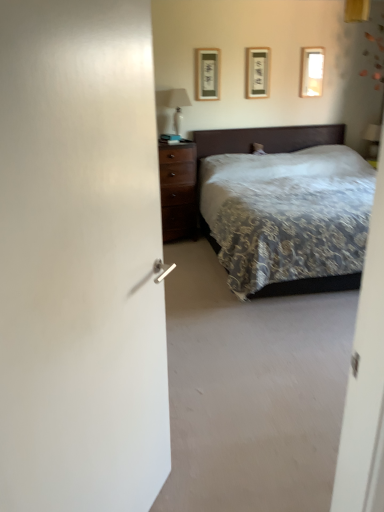
What is the approximate width of white glossy table lamp at upper center, placed as the second table lamp when sorted from right to left?

white glossy table lamp at upper center, placed as the second table lamp when sorted from right to left, is 10.51 inches wide.

Describe the element at coordinates (372, 139) in the screenshot. I see `matte white plastic table lamp at upper right, the 1th table lamp in the back-to-front sequence` at that location.

What do you see at coordinates (261, 143) in the screenshot?
I see `patterned fabric bed at center` at bounding box center [261, 143].

Measure the distance between matte black picture frame at upper center, which appears as the 3th picture frame when viewed from the right, and camera.

matte black picture frame at upper center, which appears as the 3th picture frame when viewed from the right, and camera are 16.75 feet apart from each other.

The image size is (384, 512). What are the coordinates of `matte glass picture frame at upper right, the 3th picture frame positioned from the left` in the screenshot? It's located at click(x=311, y=72).

Locate an element on the screen. Image resolution: width=384 pixels, height=512 pixels. white glossy table lamp at upper center, marked as the 1th table lamp in a left-to-right arrangement is located at coordinates (173, 104).

Is white glossy table lamp at upper center, placed as the second table lamp when sorted from right to left, facing away from patterned fabric bed at center?

No, white glossy table lamp at upper center, placed as the second table lamp when sorted from right to left,'s orientation is not away from patterned fabric bed at center.

Would you say white glossy table lamp at upper center, placed as the second table lamp when sorted from right to left, is to the left or to the right of patterned fabric bed at center in the picture?

white glossy table lamp at upper center, placed as the second table lamp when sorted from right to left, is to the left of patterned fabric bed at center.

From a real-world perspective, does white glossy table lamp at upper center, placed as the second table lamp when sorted from right to left, sit lower than patterned fabric bed at center?

No, from a real-world perspective, white glossy table lamp at upper center, placed as the second table lamp when sorted from right to left, is not under patterned fabric bed at center.

In order to click on bed to the right of white glossy table lamp at upper center, acting as the 1th table lamp starting from the front in this screenshot , I will do `click(261, 143)`.

Which is more to the left, matte wooden picture frame at upper center, which appears as the second picture frame when viewed from the left, or matte white plastic table lamp at upper right, acting as the 1th table lamp starting from the right?

matte wooden picture frame at upper center, which appears as the second picture frame when viewed from the left, is more to the left.

From the image's perspective, relative to matte white plastic table lamp at upper right, which is the 2th table lamp in front-to-back order, is matte wooden picture frame at upper center, which appears as the second picture frame when viewed from the left, above or below?

Based on their image positions, matte wooden picture frame at upper center, which appears as the second picture frame when viewed from the left, is located above matte white plastic table lamp at upper right, which is the 2th table lamp in front-to-back order.

Measure the distance from matte wooden picture frame at upper center, which appears as the second picture frame when viewed from the left, to matte white plastic table lamp at upper right, the 1th table lamp in the back-to-front sequence.

The distance of matte wooden picture frame at upper center, which appears as the second picture frame when viewed from the left, from matte white plastic table lamp at upper right, the 1th table lamp in the back-to-front sequence, is 1.85 meters.

Which of these two, matte wooden picture frame at upper center, which appears as the second picture frame when viewed from the left, or matte white plastic table lamp at upper right, which is the 2th table lamp in front-to-back order, is smaller?

Smaller between the two is matte wooden picture frame at upper center, which appears as the second picture frame when viewed from the left.

Is the position of patterned fabric bed at center more distant than that of matte black picture frame at upper center, which appears as the 3th picture frame when viewed from the right?

No.

Is matte black picture frame at upper center, arranged as the first picture frame when viewed from the left, a part of patterned fabric bed at center?

No, matte black picture frame at upper center, arranged as the first picture frame when viewed from the left, is not surrounded by patterned fabric bed at center.

Where is `the 1st picture frame behind the patterned fabric bed at center, counting from the anchor's position`? This screenshot has height=512, width=384. the 1st picture frame behind the patterned fabric bed at center, counting from the anchor's position is located at coordinates (207, 74).

Is there a large distance between patterned fabric bed at center and matte black picture frame at upper center, which appears as the 3th picture frame when viewed from the right?

patterned fabric bed at center is actually quite close to matte black picture frame at upper center, which appears as the 3th picture frame when viewed from the right.

Is white glossy table lamp at upper center, the 2th table lamp in the back-to-front sequence, far away from matte glass picture frame at upper right, the 1th picture frame when ordered from right to left?

Absolutely, white glossy table lamp at upper center, the 2th table lamp in the back-to-front sequence, is distant from matte glass picture frame at upper right, the 1th picture frame when ordered from right to left.

Visually, is white glossy table lamp at upper center, marked as the 1th table lamp in a left-to-right arrangement, positioned to the left or to the right of matte glass picture frame at upper right, the 3th picture frame positioned from the left?

Clearly, white glossy table lamp at upper center, marked as the 1th table lamp in a left-to-right arrangement, is on the left of matte glass picture frame at upper right, the 3th picture frame positioned from the left, in the image.

Considering the relative sizes of white glossy table lamp at upper center, acting as the 1th table lamp starting from the front, and matte glass picture frame at upper right, the 3th picture frame positioned from the left, in the image provided, is white glossy table lamp at upper center, acting as the 1th table lamp starting from the front, taller than matte glass picture frame at upper right, the 3th picture frame positioned from the left,?

Indeed, white glossy table lamp at upper center, acting as the 1th table lamp starting from the front, has a greater height compared to matte glass picture frame at upper right, the 3th picture frame positioned from the left.

From the image's perspective, which picture frame is the 3rd one above the white glossy table lamp at upper center, placed as the second table lamp when sorted from right to left? Please provide its 2D coordinates.

[(311, 72)]

From the image's perspective, which is below, matte black picture frame at upper center, arranged as the first picture frame when viewed from the left, or patterned fabric bed at center?

patterned fabric bed at center is shown below in the image.

Is matte black picture frame at upper center, arranged as the first picture frame when viewed from the left, smaller than patterned fabric bed at center?

Yes, matte black picture frame at upper center, arranged as the first picture frame when viewed from the left, is smaller than patterned fabric bed at center.

From a real-world perspective, count 3rd picture frames upward from the patterned fabric bed at center and point to it. Please provide its 2D coordinates.

[(207, 74)]

Is there a large distance between matte black picture frame at upper center, arranged as the first picture frame when viewed from the left, and matte white plastic table lamp at upper right, acting as the 1th table lamp starting from the right?

Yes, matte black picture frame at upper center, arranged as the first picture frame when viewed from the left, is far from matte white plastic table lamp at upper right, acting as the 1th table lamp starting from the right.

Would you say matte black picture frame at upper center, arranged as the first picture frame when viewed from the left, contains matte white plastic table lamp at upper right, acting as the 1th table lamp starting from the right?

No, matte white plastic table lamp at upper right, acting as the 1th table lamp starting from the right, is located outside of matte black picture frame at upper center, arranged as the first picture frame when viewed from the left.

Measure the distance from matte black picture frame at upper center, which appears as the 3th picture frame when viewed from the right, to matte white plastic table lamp at upper right, which is the 2th table lamp in front-to-back order.

8.28 feet.

Does matte white plastic table lamp at upper right, which is the 2th table lamp in front-to-back order, touch matte glass picture frame at upper right, the 3th picture frame positioned from the left?

No, matte white plastic table lamp at upper right, which is the 2th table lamp in front-to-back order, is not with matte glass picture frame at upper right, the 3th picture frame positioned from the left.

Is matte white plastic table lamp at upper right, acting as the 1th table lamp starting from the right, looking in the opposite direction of matte glass picture frame at upper right, the 1th picture frame when ordered from right to left?

No.

How distant is matte white plastic table lamp at upper right, which is the 2th table lamp in front-to-back order, from matte glass picture frame at upper right, the 3th picture frame positioned from the left?

matte white plastic table lamp at upper right, which is the 2th table lamp in front-to-back order, and matte glass picture frame at upper right, the 3th picture frame positioned from the left, are 1.11 meters apart from each other.

Identify the location of bed below the white glossy table lamp at upper center, marked as the 1th table lamp in a left-to-right arrangement (from the image's perspective). (261, 143).

Where is `the 2nd picture frame above when counting from the matte white plastic table lamp at upper right, which is the 2th table lamp in front-to-back order (from the image's perspective)`? the 2nd picture frame above when counting from the matte white plastic table lamp at upper right, which is the 2th table lamp in front-to-back order (from the image's perspective) is located at coordinates (257, 72).

Which object lies nearer to the anchor point matte glass picture frame at upper right, the 1th picture frame when ordered from right to left, white glossy table lamp at upper center, acting as the 1th table lamp starting from the front, or patterned fabric bed at center?

Based on the image, patterned fabric bed at center appears to be nearer to matte glass picture frame at upper right, the 1th picture frame when ordered from right to left.

From the image, which object appears to be farther from matte black picture frame at upper center, which appears as the 3th picture frame when viewed from the right, matte white plastic table lamp at upper right, acting as the 1th table lamp starting from the right, or white glossy table lamp at upper center, the 2th table lamp in the back-to-front sequence?

Among the two, matte white plastic table lamp at upper right, acting as the 1th table lamp starting from the right, is located further to matte black picture frame at upper center, which appears as the 3th picture frame when viewed from the right.

When comparing their distances from matte black picture frame at upper center, which appears as the 3th picture frame when viewed from the right, does matte wooden picture frame at upper center, the second picture frame viewed from the right, or matte glass picture frame at upper right, the 1th picture frame when ordered from right to left, seem further?

Based on the image, matte glass picture frame at upper right, the 1th picture frame when ordered from right to left, appears to be further to matte black picture frame at upper center, which appears as the 3th picture frame when viewed from the right.

When comparing their distances from white glossy table lamp at upper center, acting as the 1th table lamp starting from the front, does matte white plastic table lamp at upper right, which is the 2th table lamp in front-to-back order, or matte black picture frame at upper center, which appears as the 3th picture frame when viewed from the right, seem closer?

The object closer to white glossy table lamp at upper center, acting as the 1th table lamp starting from the front, is matte black picture frame at upper center, which appears as the 3th picture frame when viewed from the right.

When comparing their distances from matte glass picture frame at upper right, the 3th picture frame positioned from the left, does patterned fabric bed at center or matte wooden picture frame at upper center, the second picture frame viewed from the right, seem further?

Based on the image, patterned fabric bed at center appears to be further to matte glass picture frame at upper right, the 3th picture frame positioned from the left.

Estimate the real-world distances between objects in this image. Which object is closer to white glossy table lamp at upper center, placed as the second table lamp when sorted from right to left, matte black picture frame at upper center, which appears as the 3th picture frame when viewed from the right, or matte white plastic table lamp at upper right, the 1th table lamp in the back-to-front sequence?

Based on the image, matte black picture frame at upper center, which appears as the 3th picture frame when viewed from the right, appears to be nearer to white glossy table lamp at upper center, placed as the second table lamp when sorted from right to left.

Based on their spatial positions, is matte white plastic table lamp at upper right, acting as the 1th table lamp starting from the right, or matte black picture frame at upper center, which appears as the 3th picture frame when viewed from the right, further from matte glass picture frame at upper right, the 1th picture frame when ordered from right to left?

matte black picture frame at upper center, which appears as the 3th picture frame when viewed from the right, lies further to matte glass picture frame at upper right, the 1th picture frame when ordered from right to left, than the other object.

From the picture: Estimate the real-world distances between objects in this image. Which object is further from matte glass picture frame at upper right, the 3th picture frame positioned from the left, white glossy table lamp at upper center, the 2th table lamp in the back-to-front sequence, or matte white plastic table lamp at upper right, the 1th table lamp in the back-to-front sequence?

Among the two, white glossy table lamp at upper center, the 2th table lamp in the back-to-front sequence, is located further to matte glass picture frame at upper right, the 3th picture frame positioned from the left.

Where is `table lamp located between patterned fabric bed at center and matte wooden picture frame at upper center, the second picture frame viewed from the right, in the depth direction`? This screenshot has height=512, width=384. table lamp located between patterned fabric bed at center and matte wooden picture frame at upper center, the second picture frame viewed from the right, in the depth direction is located at coordinates 173,104.

Where is `bed located between white glossy table lamp at upper center, marked as the 1th table lamp in a left-to-right arrangement, and matte white plastic table lamp at upper right, acting as the 2th table lamp starting from the left, in the left-right direction`? The width and height of the screenshot is (384, 512). bed located between white glossy table lamp at upper center, marked as the 1th table lamp in a left-to-right arrangement, and matte white plastic table lamp at upper right, acting as the 2th table lamp starting from the left, in the left-right direction is located at coordinates (261, 143).

I want to click on picture frame between patterned fabric bed at center and matte wooden picture frame at upper center, the second picture frame viewed from the right, along the z-axis, so click(207, 74).

Where is `table lamp between patterned fabric bed at center and matte black picture frame at upper center, arranged as the first picture frame when viewed from the left, from front to back`? This screenshot has height=512, width=384. table lamp between patterned fabric bed at center and matte black picture frame at upper center, arranged as the first picture frame when viewed from the left, from front to back is located at coordinates (173, 104).